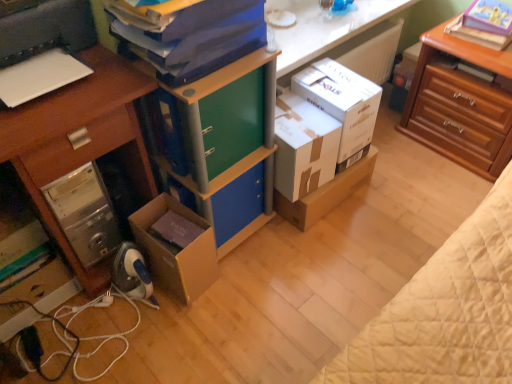
Image resolution: width=512 pixels, height=384 pixels. What are the coordinates of `unoccupied area in front of blue matte bookshelf at center` in the screenshot? It's located at (241, 294).